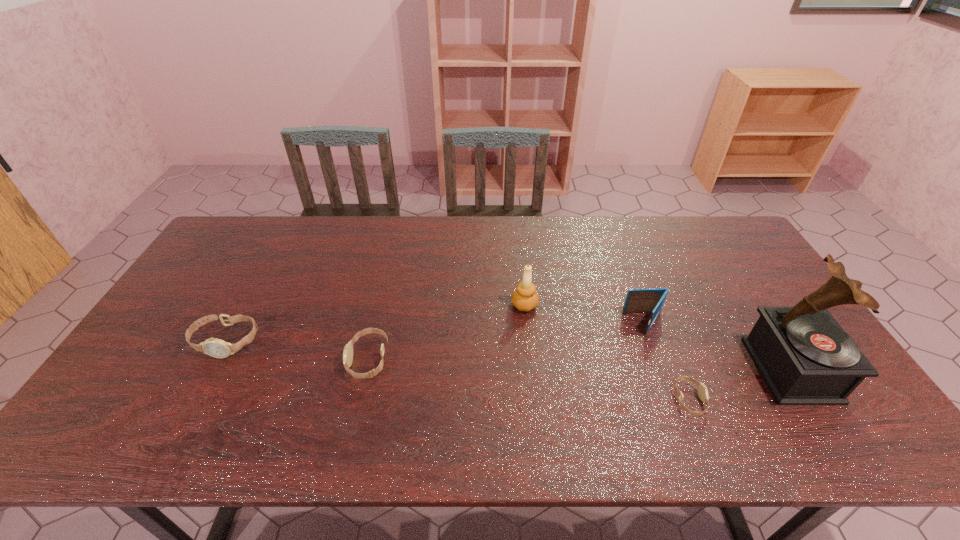
The image size is (960, 540). Find the location of `free space located 0.140m on the face of the leftmost watch`. free space located 0.140m on the face of the leftmost watch is located at coordinates (191, 406).

This screenshot has width=960, height=540. I want to click on vacant position located 0.390m on the face of the second shortest watch, so click(x=201, y=360).

Find the location of a particular element. The image size is (960, 540). free location located 0.290m on the face of the second shortest watch is located at coordinates (239, 360).

Find the location of a particular element. Image resolution: width=960 pixels, height=540 pixels. free point located on the face of the second shortest watch is located at coordinates (330, 360).

Locate an element on the screen. Image resolution: width=960 pixels, height=540 pixels. vacant space located on the face of the rightmost watch is located at coordinates (760, 400).

Where is `free location located on the left of the second tallest object`? The image size is (960, 540). free location located on the left of the second tallest object is located at coordinates (464, 305).

Locate an element on the screen. The image size is (960, 540). vacant space located on the exterior surface of the wallet is located at coordinates tap(587, 323).

Find the location of a particular element. Image resolution: width=960 pixels, height=540 pixels. free space located 0.090m on the exterior surface of the wallet is located at coordinates (594, 323).

You are a GUI agent. You are given a task and a screenshot of the screen. Output one action in this format:
    pyautogui.click(x=<x>, y=<y>)
    Task: Click on the free space located on the exterior surface of the wallet
    
    Given the screenshot: What is the action you would take?
    pyautogui.click(x=597, y=323)

Identify the location of vacant region located at the horn opening of the rightmost object. The image size is (960, 540). (714, 370).